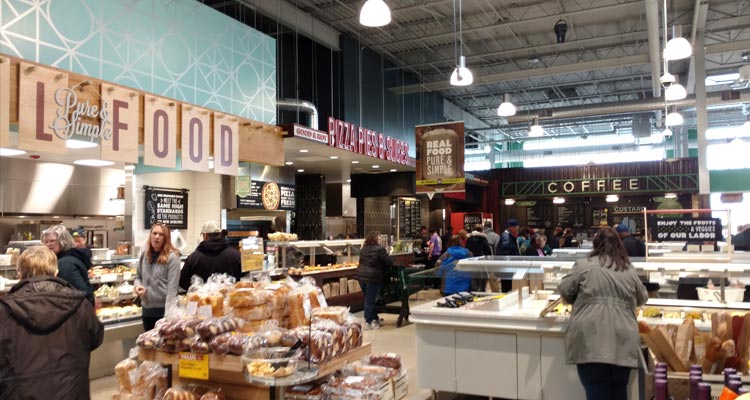
Find the location of a particular element. blue and white wall decor top left corner is located at coordinates (231, 64), (170, 48), (72, 55), (145, 382).